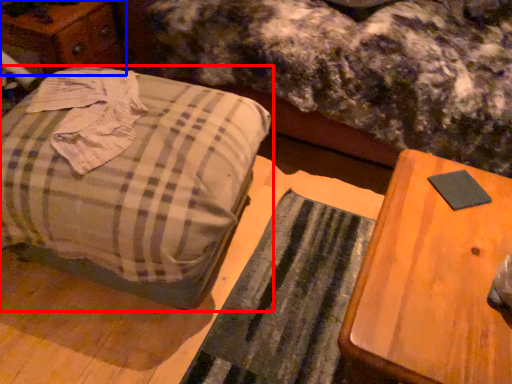
Question: Among these objects, which one is farthest to the camera, furniture (highlighted by a red box) or dresser (highlighted by a blue box)?

Choices:
 (A) furniture
 (B) dresser

Answer: (B)